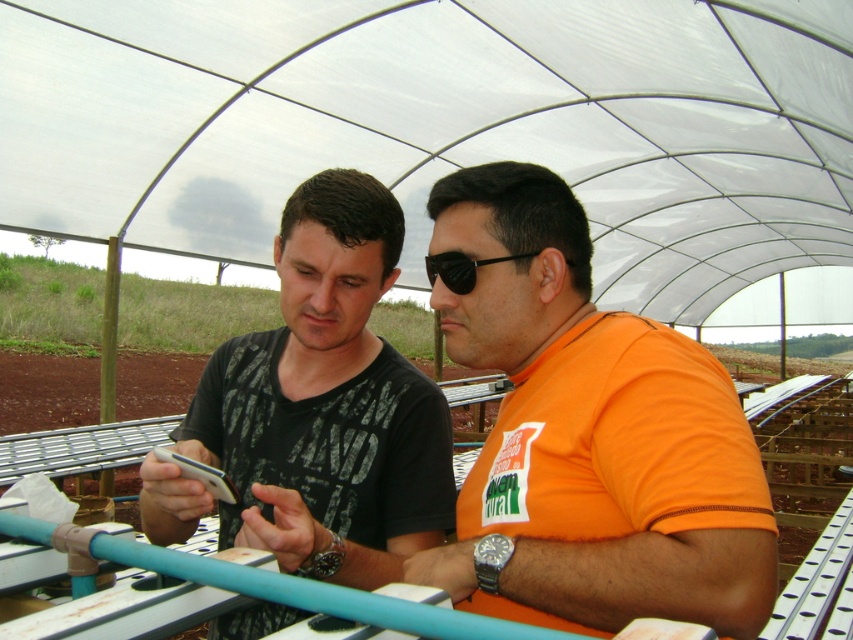
Is orange cotton shirt at center closer to camera compared to black matte shirt at center?

Yes, orange cotton shirt at center is closer to the viewer.

Based on the photo, is orange cotton shirt at center to the right of black matte shirt at center from the viewer's perspective?

Yes, orange cotton shirt at center is to the right of black matte shirt at center.

The width and height of the screenshot is (853, 640). What are the coordinates of `orange cotton shirt at center` in the screenshot? It's located at (589, 436).

Between orange cotton shirt at center and black plastic goggles at center, which one appears on the left side from the viewer's perspective?

Positioned to the left is black plastic goggles at center.

Which is above, orange cotton shirt at center or black plastic goggles at center?

black plastic goggles at center is above.

Who is more distant from viewer, (498, 538) or (524, 253)?

The point (524, 253) is more distant.

Image resolution: width=853 pixels, height=640 pixels. I want to click on orange cotton shirt at center, so click(589, 436).

Can you confirm if black matte shirt at center is wider than black plastic goggles at center?

Indeed, black matte shirt at center has a greater width compared to black plastic goggles at center.

Does black matte shirt at center appear on the right side of black plastic goggles at center?

No, black matte shirt at center is not to the right of black plastic goggles at center.

Between point (322, 528) and point (434, 266), which one is positioned behind?

Point (434, 266)

This screenshot has width=853, height=640. Identify the location of black matte shirt at center. (328, 403).